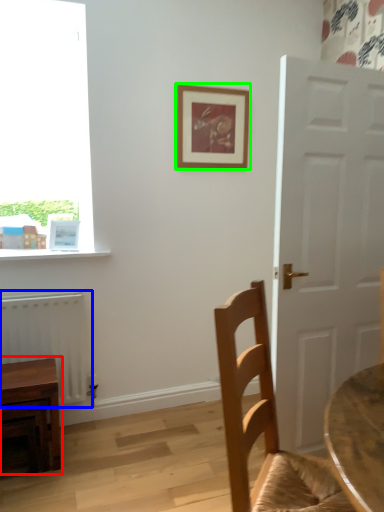
Question: Estimate the real-world distances between objects in this image. Which object is farther from table (highlighted by a red box), radiator (highlighted by a blue box) or picture frame (highlighted by a green box)?

Choices:
 (A) radiator
 (B) picture frame

Answer: (B)